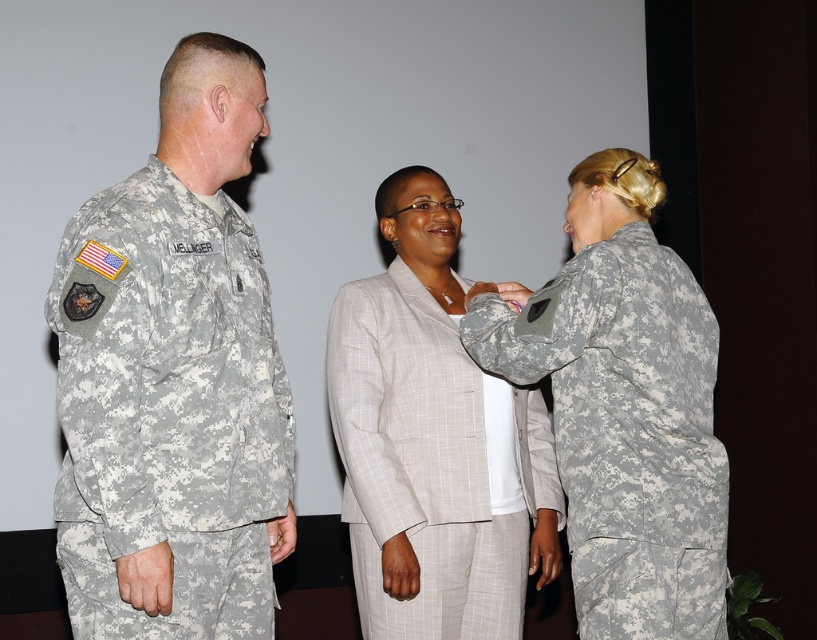
In the image of the military ceremony, there are three people present. Two are in military uniforms and one is in civilian attire. The camouflage uniform at right is represented by point (623, 406). The civilian attire is represented by point 0.333, 0.456. The other military uniform is represented by point 0.891, 0.923. Which person is standing closest to the camouflage uniform at right?

The other military uniform at point 0.891, 0.923 is closest to the camouflage uniform at right.

You are attending a military ceremony and need to locate the camouflage uniform at left. Based on the coordinates provided in the Objects Description, can you determine if it is positioned closer to the top or bottom of the image?

The camouflage uniform at left is located at point (173,378). Since the y coordinate is 0.213, which is closer to the bottom of the image, the camouflage uniform at left is positioned closer to the bottom.